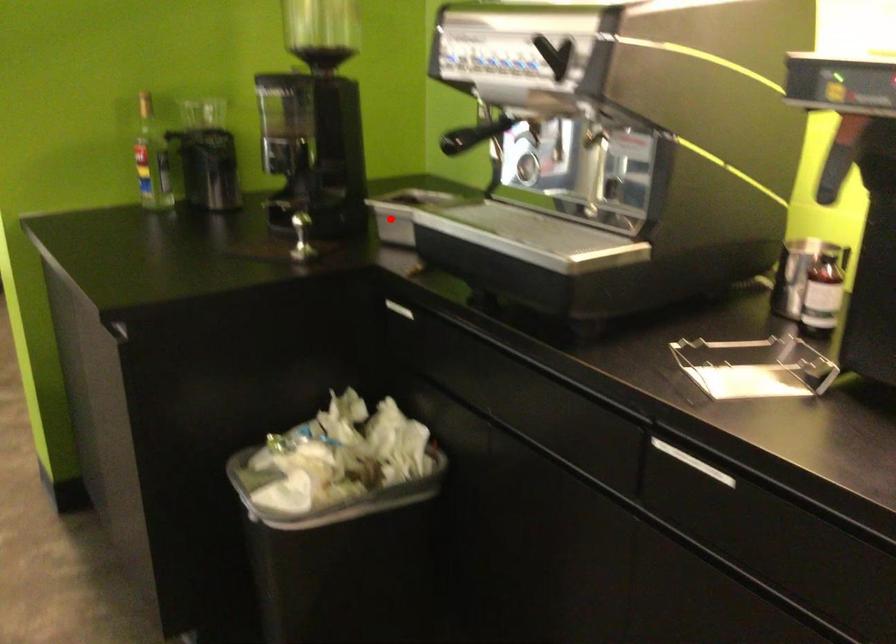
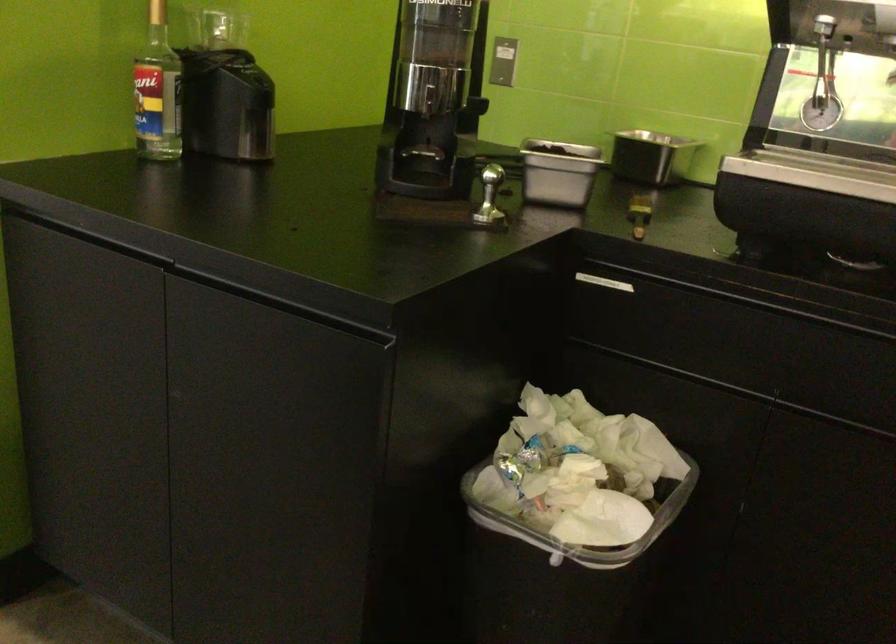
In the second image, find the point that corresponds to the highlighted location in the first image.

(558, 172)